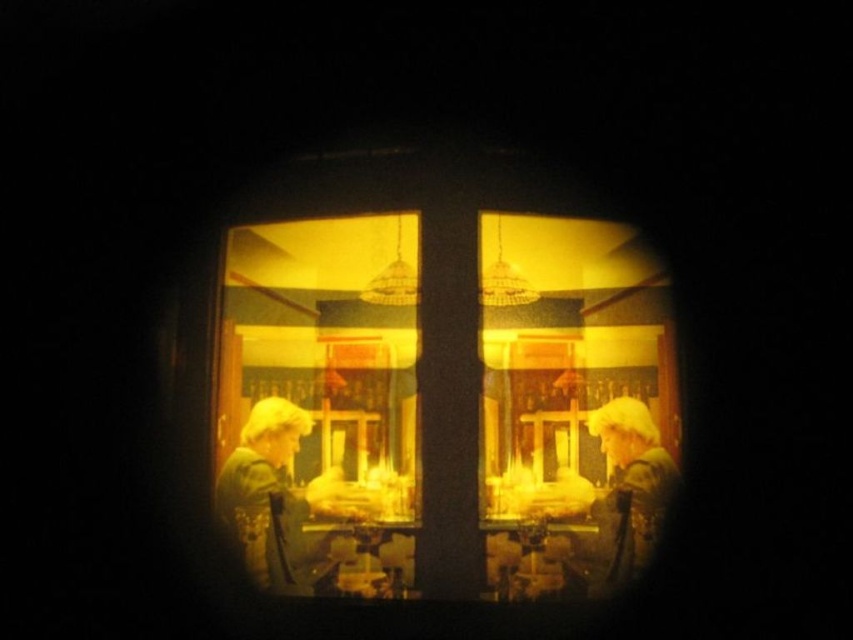
Question: Which object is the closest to the matte silver helmet at center?

Choices:
 (A) matte glass shop window at center
 (B) matte green dress at center

Answer: (A)

Question: Which point is closer to the camera?

Choices:
 (A) matte green dress at center
 (B) matte silver helmet at center

Answer: (B)

Question: Is matte glass shop window at center above matte silver helmet at center?

Choices:
 (A) no
 (B) yes

Answer: (B)

Question: Can you confirm if matte green dress at center is thinner than matte silver helmet at center?

Choices:
 (A) no
 (B) yes

Answer: (A)

Question: Does matte green dress at center lie behind matte silver helmet at center?

Choices:
 (A) yes
 (B) no

Answer: (A)

Question: Among these points, which one is farthest from the camera?

Choices:
 (A) (592, 586)
 (B) (234, 339)
 (C) (248, 493)

Answer: (B)